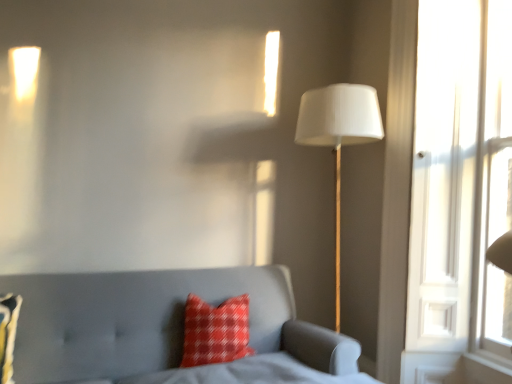
Question: Is red plaid pillow at lower left, placed as the 1th pillow when sorted from front to back, located within matte gray sofa at lower left?

Choices:
 (A) yes
 (B) no

Answer: (A)

Question: Can you confirm if matte gray sofa at lower left is positioned to the right of red plaid pillow at lower left, which is counted as the 2th pillow, starting from the back?

Choices:
 (A) yes
 (B) no

Answer: (A)

Question: Does matte gray sofa at lower left have a smaller size compared to red plaid pillow at lower left, placed as the 1th pillow when sorted from front to back?

Choices:
 (A) no
 (B) yes

Answer: (A)

Question: Would you consider matte gray sofa at lower left to be distant from red plaid pillow at lower left, acting as the first pillow starting from the left?

Choices:
 (A) no
 (B) yes

Answer: (A)

Question: Does matte gray sofa at lower left turn towards red plaid pillow at lower left, which is the 2th pillow in right-to-left order?

Choices:
 (A) no
 (B) yes

Answer: (A)

Question: Are matte gray sofa at lower left and red plaid pillow at lower left, placed as the 1th pillow when sorted from front to back, beside each other?

Choices:
 (A) yes
 (B) no

Answer: (B)

Question: Does matte gray sofa at lower left touch white fabric lampshade at right?

Choices:
 (A) yes
 (B) no

Answer: (B)

Question: Considering the relative positions of matte gray sofa at lower left and white fabric lampshade at right in the image provided, is matte gray sofa at lower left to the right of white fabric lampshade at right from the viewer's perspective?

Choices:
 (A) yes
 (B) no

Answer: (B)

Question: Can you confirm if matte gray sofa at lower left is bigger than white fabric lampshade at right?

Choices:
 (A) yes
 (B) no

Answer: (A)

Question: Is matte gray sofa at lower left positioned with its back to white fabric lampshade at right?

Choices:
 (A) no
 (B) yes

Answer: (A)

Question: From a real-world perspective, is matte gray sofa at lower left positioned over white fabric lampshade at right based on gravity?

Choices:
 (A) yes
 (B) no

Answer: (B)

Question: Can you confirm if matte gray sofa at lower left is shorter than white fabric lampshade at right?

Choices:
 (A) no
 (B) yes

Answer: (B)

Question: Does white fabric lampshade at right appear on the left side of matte gray sofa at lower left?

Choices:
 (A) yes
 (B) no

Answer: (B)